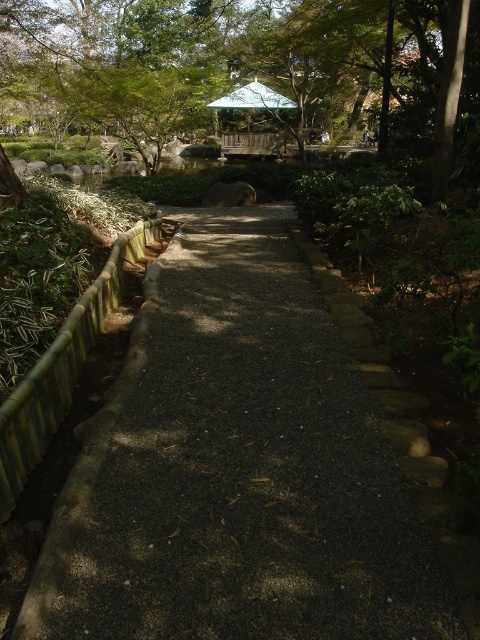
Does dark gravel path at center appear over green wooden gazebo at upper center?

No.

Between point (144, 554) and point (231, 99), which one is positioned in front?

Positioned in front is point (144, 554).

Who is more forward, (372, 388) or (228, 154)?

Point (372, 388)

Locate an element on the screen. This screenshot has width=480, height=640. dark gravel path at center is located at coordinates (245, 461).

Is green leafy tree at upper left positioned in front of green wooden gazebo at upper center?

Yes, green leafy tree at upper left is in front of green wooden gazebo at upper center.

Is green leafy tree at upper left smaller than green wooden gazebo at upper center?

No.

Identify the location of green leafy tree at upper left. Image resolution: width=480 pixels, height=640 pixels. (242, 61).

Based on the photo, can you confirm if dark gravel path at center is shorter than green leafy tree at upper left?

Yes.

Does dark gravel path at center appear on the right side of green leafy tree at upper left?

Correct, you'll find dark gravel path at center to the right of green leafy tree at upper left.

Is point (389, 573) less distant than point (291, 102)?

That is True.

The height and width of the screenshot is (640, 480). Identify the location of dark gravel path at center. (245, 461).